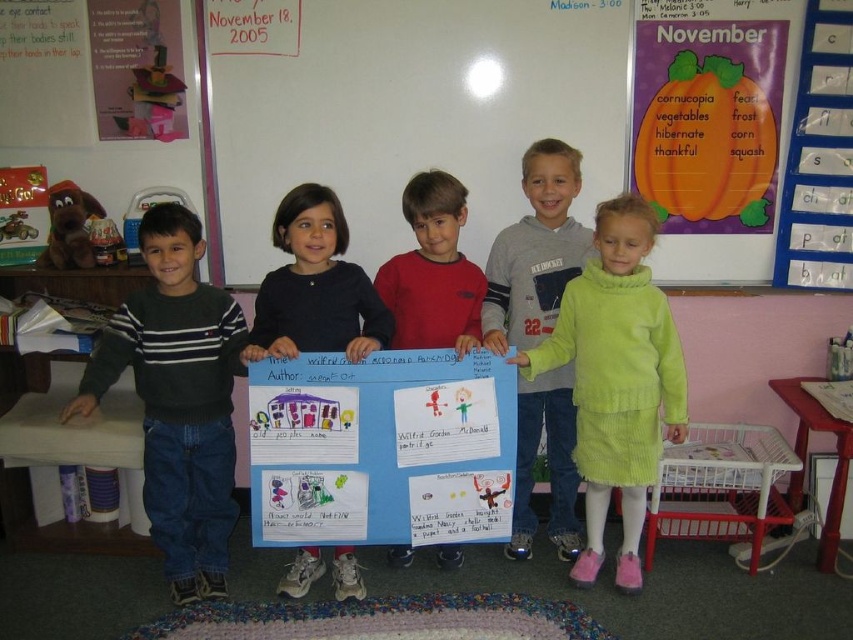
Consider the image. Between dark green sweater at left and green corduroy dress at center, which one appears on the left side from the viewer's perspective?

Positioned to the left is dark green sweater at left.

Does dark green sweater at left have a larger size compared to green corduroy dress at center?

Yes, dark green sweater at left is bigger than green corduroy dress at center.

Which is behind, point (155, 307) or point (654, 474)?

Positioned behind is point (654, 474).

The image size is (853, 640). Identify the location of dark green sweater at left. (178, 397).

Between dark green sweater at left and light green sweater at center, which one is positioned higher?

light green sweater at center is higher up.

Does point (173, 516) lie in front of point (564, 384)?

Yes, point (173, 516) is closer to viewer.

I want to click on dark green sweater at left, so click(178, 397).

Between point (160, 285) and point (375, 280), which one is positioned in front?

Point (160, 285) is in front.

I want to click on dark green sweater at left, so click(x=178, y=397).

This screenshot has height=640, width=853. Find the location of `dark green sweater at left`. dark green sweater at left is located at coordinates (178, 397).